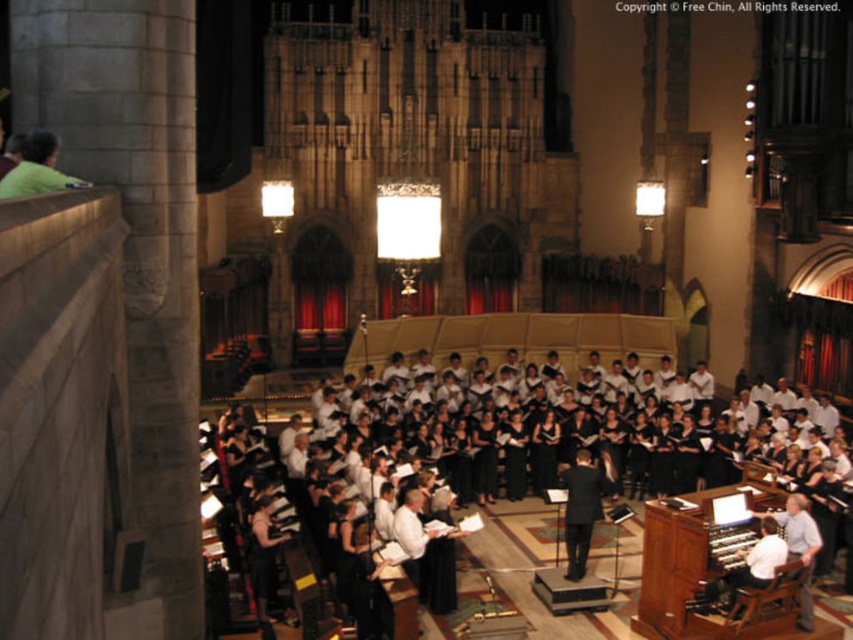
Is black suit at center above green matte shirt at upper left?

Incorrect, black suit at center is not positioned above green matte shirt at upper left.

Does black suit at center have a greater height compared to green matte shirt at upper left?

Yes.

Find the location of `black suit at center`. black suit at center is located at coordinates (584, 506).

What are the coordinates of `black suit at center` in the screenshot? It's located at (584, 506).

Does black fabric choir at center have a lesser width compared to black suit at center?

In fact, black fabric choir at center might be wider than black suit at center.

Who is shorter, black fabric choir at center or black suit at center?

With less height is black suit at center.

Does point (308, 477) come farther from viewer compared to point (595, 520)?

Yes, it is behind point (595, 520).

Where is `black fabric choir at center`? black fabric choir at center is located at coordinates pyautogui.click(x=529, y=536).

Who is positioned more to the right, green matte shirt at upper left or white fabric shirt at lower right?

Positioned to the right is white fabric shirt at lower right.

Is the position of green matte shirt at upper left less distant than that of white fabric shirt at lower right?

That is True.

Which is behind, point (61, 180) or point (802, 602)?

The point (802, 602) is behind.

Identify the location of green matte shirt at upper left. This screenshot has width=853, height=640. (38, 168).